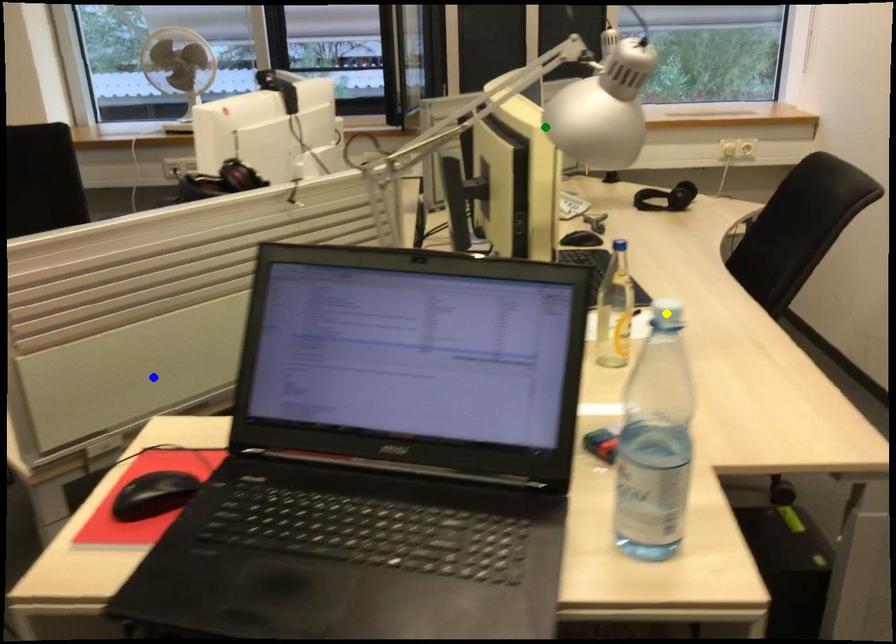
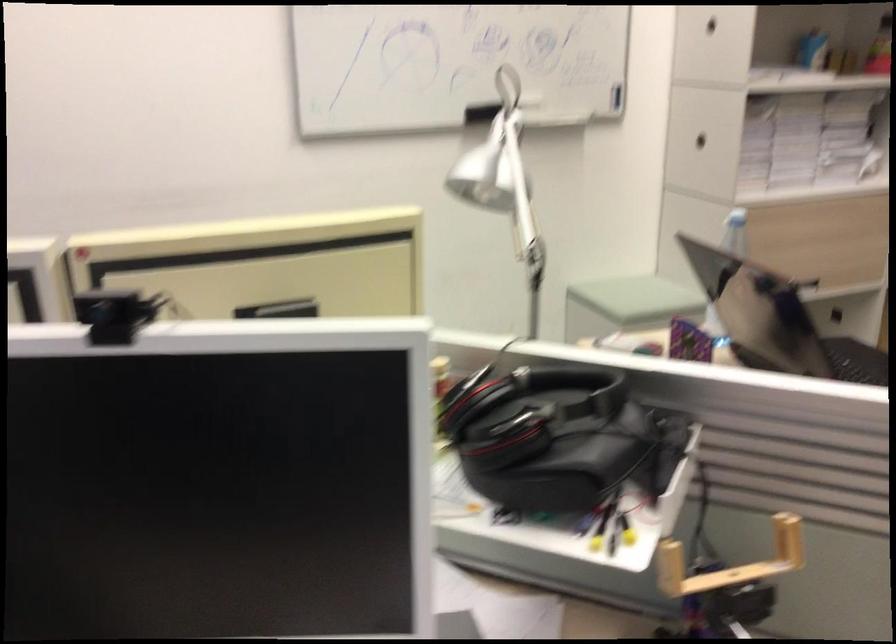
I am providing you with two images of the same scene from different viewpoints. Three points are marked in image1. Which point corresponds to a part or object that is occluded in image2?In image1, three points are marked. Which of them correspond to a part or object that is occluded in image2?Among the three points shown in image1, which one corresponds to a part or object that is no longer visible due to occlusion in image2?

yellow point